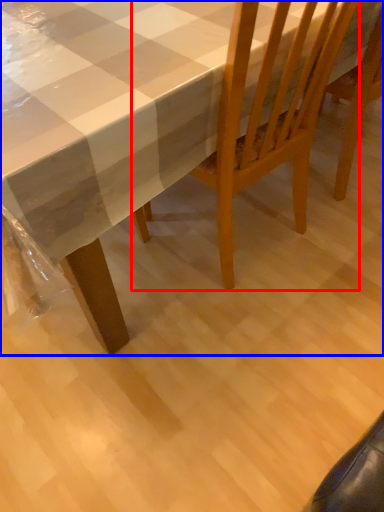
Question: Among these objects, which one is farthest to the camera, chair (highlighted by a red box) or table (highlighted by a blue box)?

Choices:
 (A) chair
 (B) table

Answer: (A)